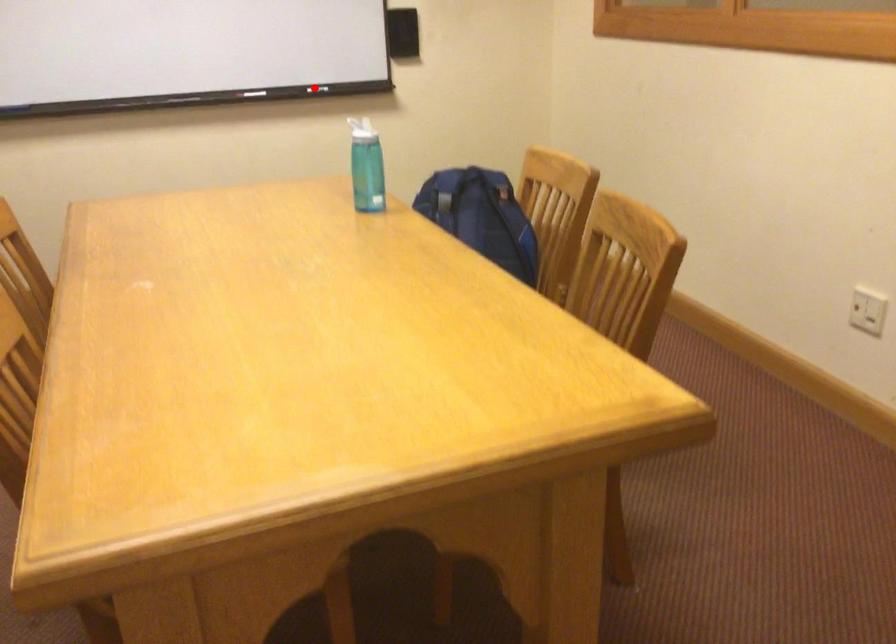
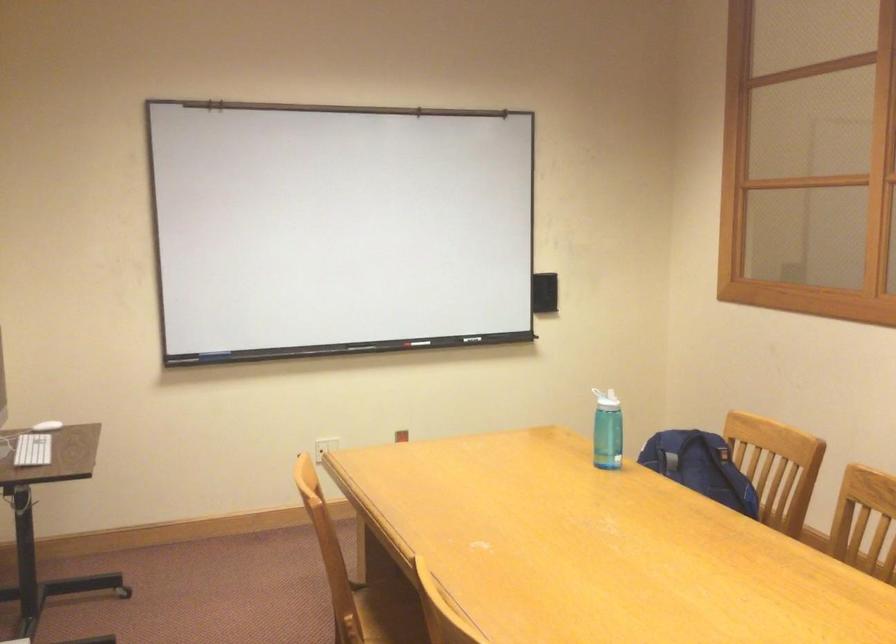
Question: A red point is marked in image1. In image2, is the corresponding 3D point closer to the camera or farther? Reply with the corresponding letter.

Choices:
 (A) The corresponding 3D point is closer.
 (B) The corresponding 3D point is farther.

Answer: (B)